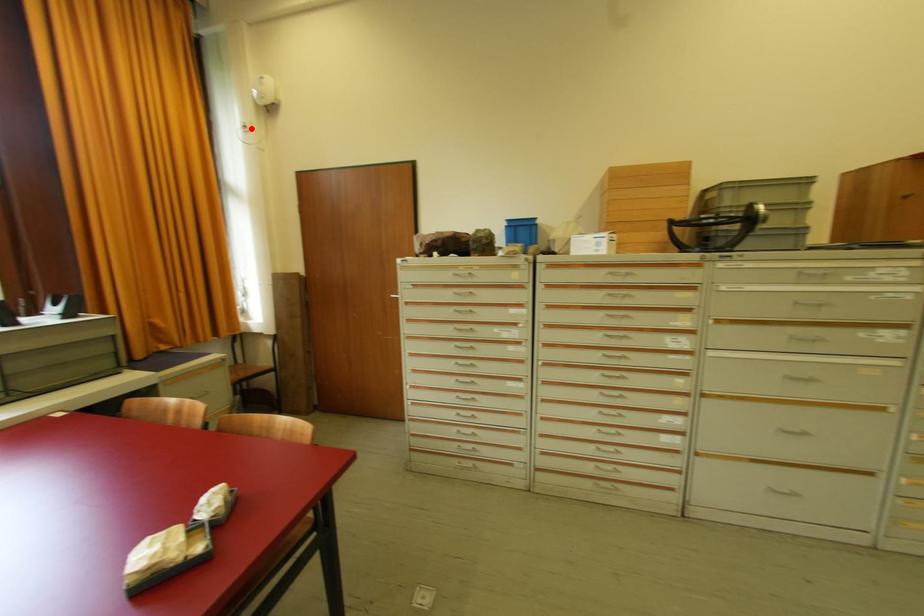
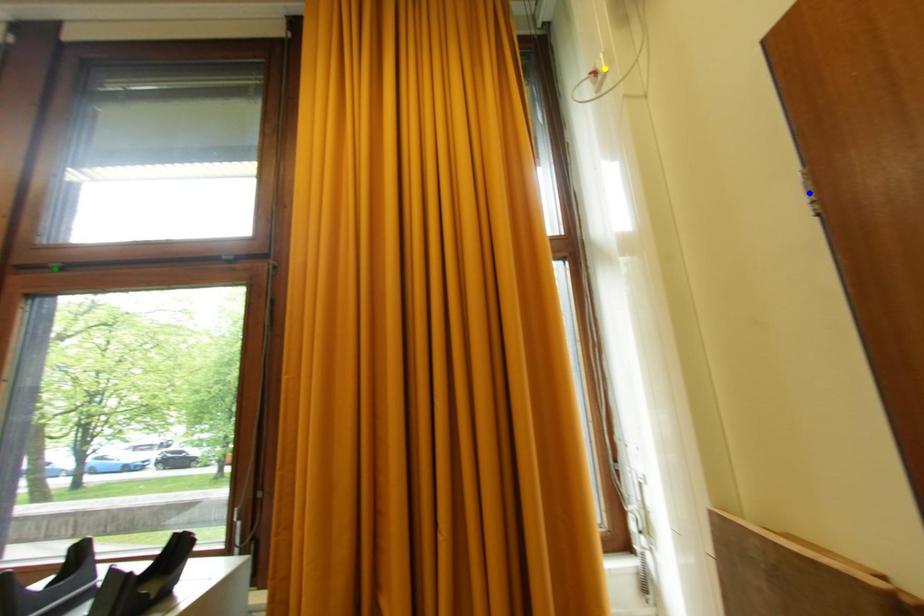
Question: I am providing you with two images of the same scene from different viewpoints. A red point is marked on the first image. You are given multiple points on the second image. Can you choose the point in image 2 that corresponds to the point in image 1?

Choices:
 (A) yellow point
 (B) green point
 (C) blue point

Answer: (A)